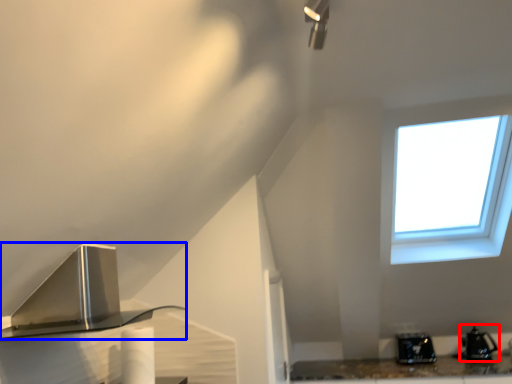
Question: Which point is closer to the camera, appliance (highlighted by a red box) or kitchen appliance (highlighted by a blue box)?

Choices:
 (A) appliance
 (B) kitchen appliance

Answer: (B)